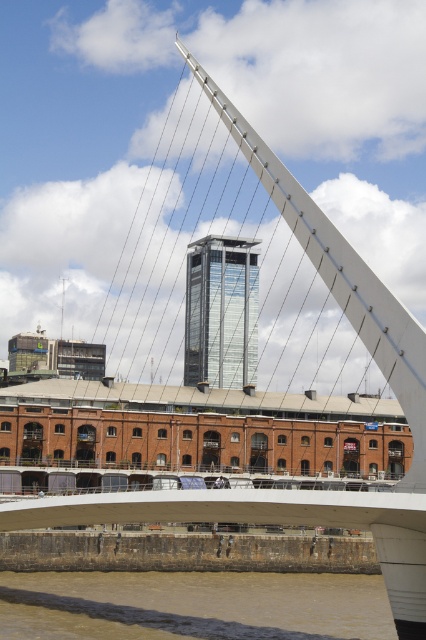
Can you confirm if brown muddy water at lower center is positioned above glassy metallic skyscraper at center?

Incorrect, brown muddy water at lower center is not positioned above glassy metallic skyscraper at center.

In the scene shown: Between brown muddy water at lower center and glassy metallic skyscraper at center, which one has more height?

glassy metallic skyscraper at center is taller.

Who is more distant from viewer, (43, 598) or (239, 362)?

The point (239, 362) is behind.

Locate an element on the screen. Image resolution: width=426 pixels, height=640 pixels. brown muddy water at lower center is located at coordinates (192, 605).